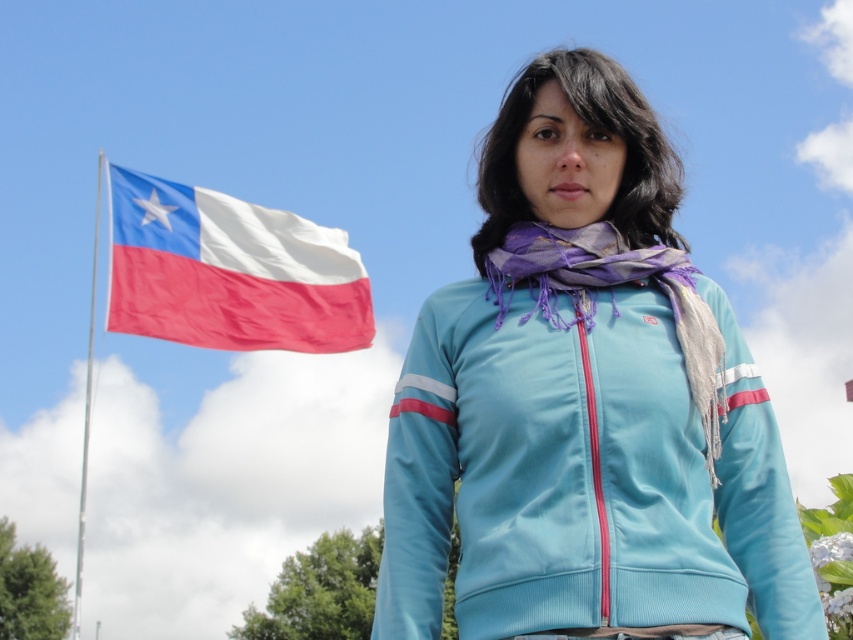
Looking at this image, does matte blue jacket at center appear under silver metallic flag pole at left?

Actually, matte blue jacket at center is above silver metallic flag pole at left.

Does matte blue jacket at center come in front of silver metallic flag pole at left?

Yes, it is.

The width and height of the screenshot is (853, 640). What do you see at coordinates (583, 468) in the screenshot?
I see `matte blue jacket at center` at bounding box center [583, 468].

I want to click on matte blue jacket at center, so pos(583,468).

Which is in front, point (216, 301) or point (86, 484)?

Point (216, 301) is more forward.

Identify the location of red fabric chilean flag at left. (229, 272).

What do you see at coordinates (583, 468) in the screenshot?
I see `matte blue jacket at center` at bounding box center [583, 468].

Can you confirm if matte blue jacket at center is positioned above purple silk scarf at center?

Actually, matte blue jacket at center is below purple silk scarf at center.

You are a GUI agent. You are given a task and a screenshot of the screen. Output one action in this format:
    pyautogui.click(x=<x>, y=<y>)
    Task: Click on the matte blue jacket at center
    
    Given the screenshot: What is the action you would take?
    pyautogui.click(x=583, y=468)

Identify the location of matte blue jacket at center. The height and width of the screenshot is (640, 853). (583, 468).